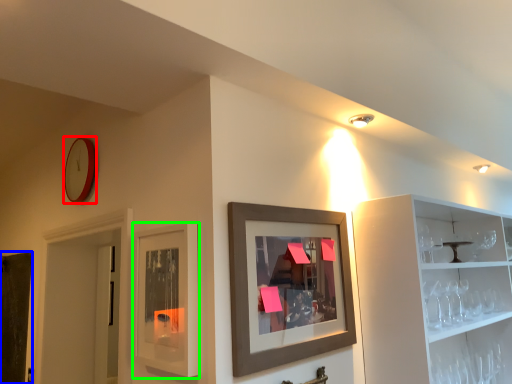
Question: Which object is the farthest from clock (highlighted by a red box)? Choose among these: door (highlighted by a blue box) or cabinet (highlighted by a green box).

Choices:
 (A) door
 (B) cabinet

Answer: (A)